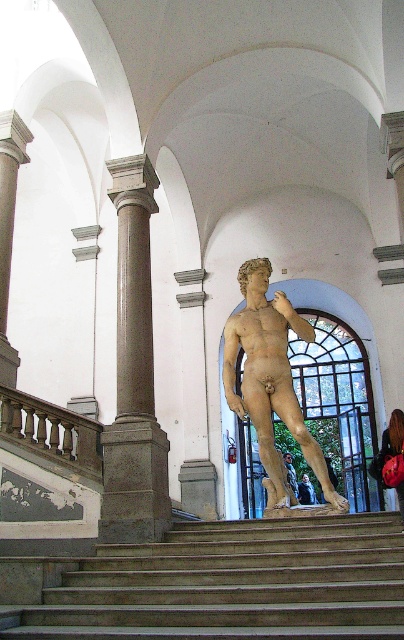
Is brown stone column at left smaller than polished bronze statue at center?

Correct, brown stone column at left occupies less space than polished bronze statue at center.

Is brown stone column at left further to camera compared to polished bronze statue at center?

No, brown stone column at left is in front of polished bronze statue at center.

Locate an element on the screen. brown stone column at left is located at coordinates (134, 372).

What do you see at coordinates (269, 380) in the screenshot? I see `polished bronze statue at center` at bounding box center [269, 380].

Does polished bronze statue at center have a greater height compared to dark brown polished wood railing at left?

Correct, polished bronze statue at center is much taller as dark brown polished wood railing at left.

Locate an element on the screen. The width and height of the screenshot is (404, 640). polished bronze statue at center is located at coordinates (269, 380).

Measure the distance from smooth concrete stairs at center to polished bronze statue at center.

smooth concrete stairs at center is 6.89 meters from polished bronze statue at center.

Measure the distance between point [319,560] and camera.

Point [319,560] and camera are 58.72 feet apart from each other.

In order to click on smooth concrete stairs at center in this screenshot , I will do `click(233, 584)`.

Locate an element on the screen. smooth concrete stairs at center is located at coordinates (233, 584).